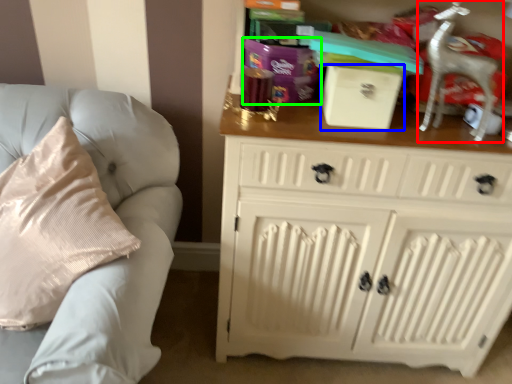
Question: Estimate the real-world distances between objects in this image. Which object is farther from rocking chair (highlighted by a red box), box (highlighted by a blue box) or gift (highlighted by a green box)?

Choices:
 (A) box
 (B) gift

Answer: (B)